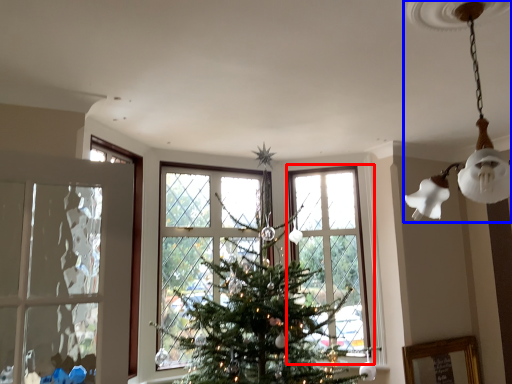
Question: Which of the following is the closest to the observer, window (highlighted by a red box) or lamp (highlighted by a blue box)?

Choices:
 (A) window
 (B) lamp

Answer: (B)